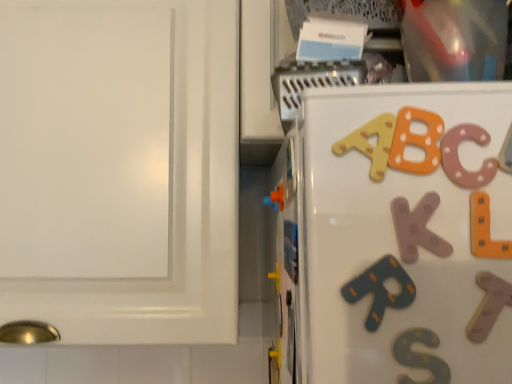
Question: Can you confirm if orange matte magnet at center is bigger than orange matte toy at center?

Choices:
 (A) no
 (B) yes

Answer: (B)

Question: Is orange matte magnet at center positioned behind orange matte toy at center?

Choices:
 (A) yes
 (B) no

Answer: (B)

Question: From the image's perspective, is orange matte magnet at center over orange matte toy at center?

Choices:
 (A) no
 (B) yes

Answer: (A)

Question: Is the position of orange matte magnet at center less distant than that of orange matte toy at center?

Choices:
 (A) yes
 (B) no

Answer: (A)

Question: Is orange matte magnet at center not within orange matte toy at center?

Choices:
 (A) no
 (B) yes

Answer: (B)

Question: Considering the positions of point (287, 240) and point (278, 205), is point (287, 240) closer or farther from the camera than point (278, 205)?

Choices:
 (A) farther
 (B) closer

Answer: (B)

Question: From a real-world perspective, is orange matte magnet at center above or below orange matte toy at center?

Choices:
 (A) below
 (B) above

Answer: (A)

Question: Considering their positions, is orange matte magnet at center located in front of or behind orange matte toy at center?

Choices:
 (A) front
 (B) behind

Answer: (A)

Question: Considering the relative positions of orange matte magnet at center and orange matte toy at center in the image provided, is orange matte magnet at center to the left or to the right of orange matte toy at center?

Choices:
 (A) left
 (B) right

Answer: (B)

Question: From a real-world perspective, is orange matte toy at center positioned above or below white glossy cabinet at upper right?

Choices:
 (A) above
 (B) below

Answer: (B)

Question: Is orange matte toy at center bigger or smaller than white glossy cabinet at upper right?

Choices:
 (A) big
 (B) small

Answer: (B)

Question: Does point (273, 192) appear closer or farther from the camera than point (179, 324)?

Choices:
 (A) farther
 (B) closer

Answer: (B)

Question: From their relative heights in the image, would you say orange matte toy at center is taller or shorter than white glossy cabinet at upper right?

Choices:
 (A) tall
 (B) short

Answer: (B)

Question: In terms of size, does orange matte magnet at center appear bigger or smaller than white glossy cabinet at upper right?

Choices:
 (A) small
 (B) big

Answer: (A)

Question: From the image's perspective, relative to white glossy cabinet at upper right, is orange matte magnet at center above or below?

Choices:
 (A) below
 (B) above

Answer: (A)